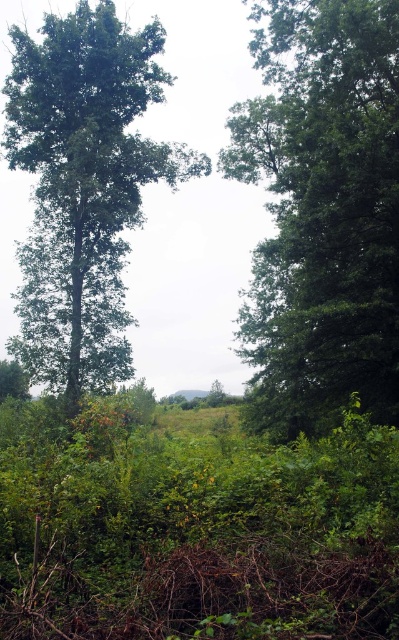
Question: Is green leafy tree at center above green leafy tree at left?

Choices:
 (A) yes
 (B) no

Answer: (A)

Question: Does green leafy tree at center have a greater width compared to green leafy tree at left?

Choices:
 (A) yes
 (B) no

Answer: (B)

Question: Does green leafy tree at center appear on the right side of green leafy tree at left?

Choices:
 (A) yes
 (B) no

Answer: (A)